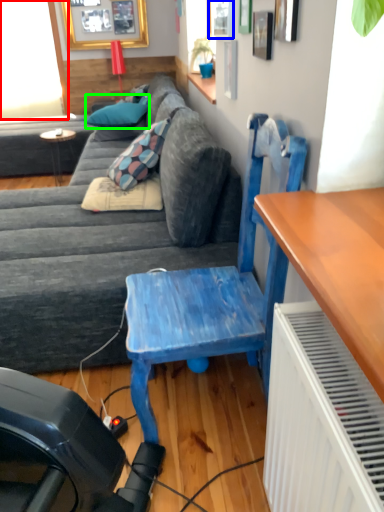
Question: Estimate the real-world distances between objects in this image. Which object is closer to window screen (highlighted by a red box), window (highlighted by a blue box) or pillow (highlighted by a green box)?

Choices:
 (A) window
 (B) pillow

Answer: (B)